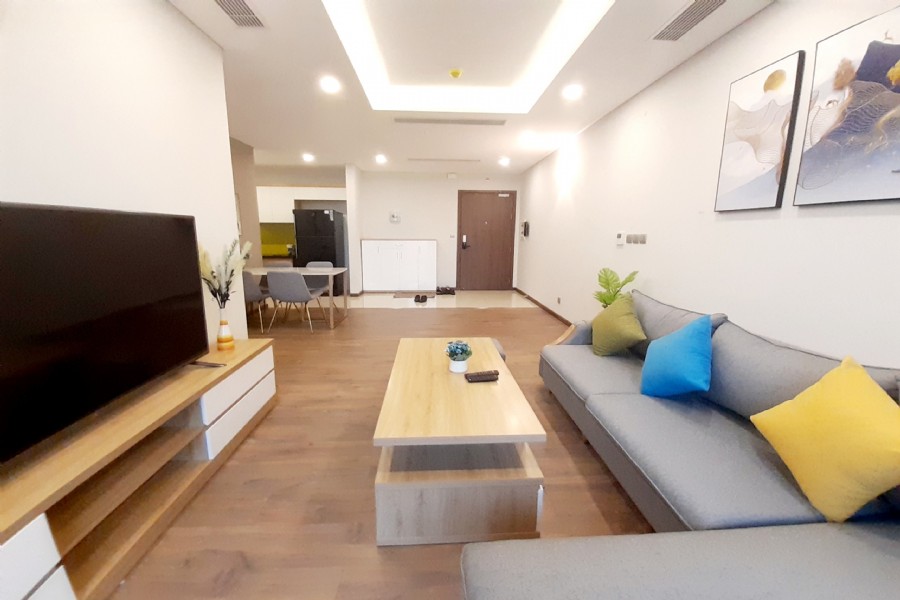
At what (x,y) coordinates should I click in order to perform the action: click on television. Please return your answer as a coordinate pair (x, y). This screenshot has width=900, height=600. Looking at the image, I should click on (63, 329).